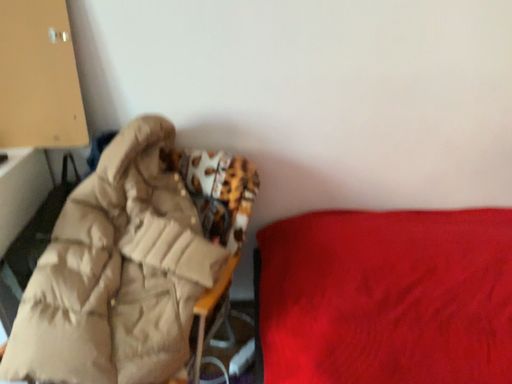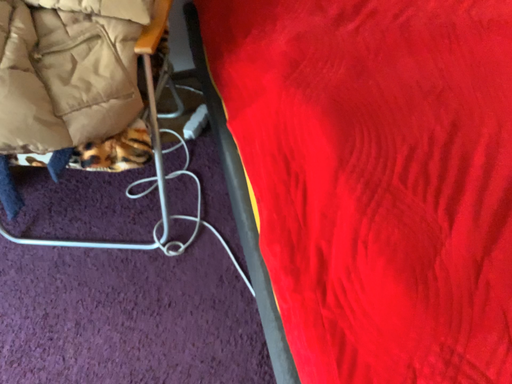
Question: How did the camera likely rotate when shooting the video?

Choices:
 (A) rotated left
 (B) rotated right

Answer: (B)